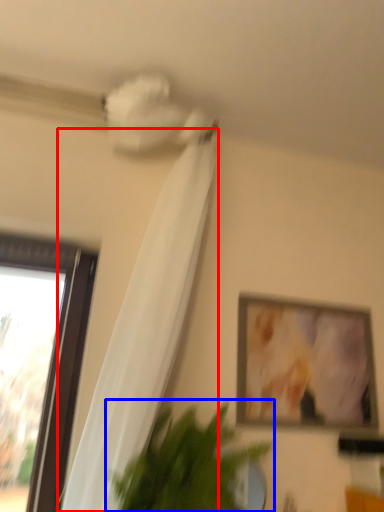
Question: Which point is closer to the camera, curtain (highlighted by a red box) or houseplant (highlighted by a blue box)?

Choices:
 (A) curtain
 (B) houseplant

Answer: (A)